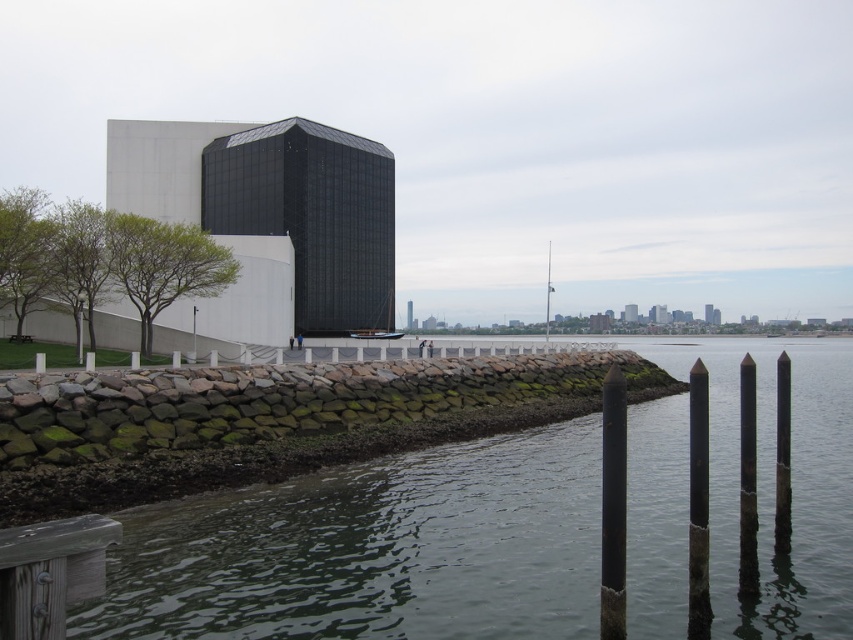
Who is taller, wooden dock at lower left or black matte pole at center?

Standing taller between the two is black matte pole at center.

Can you confirm if wooden dock at lower left is thinner than black matte pole at center?

Correct, wooden dock at lower left's width is less than black matte pole at center's.

Find the location of a particular element. wooden dock at lower left is located at coordinates coord(50,572).

Is black matte pole at lower right in front of black matte pole at center?

Yes.

What do you see at coordinates (613, 506) in the screenshot?
I see `black matte pole at lower right` at bounding box center [613, 506].

What do you see at coordinates (613, 506) in the screenshot? This screenshot has width=853, height=640. I see `black matte pole at lower right` at bounding box center [613, 506].

Where is `black matte pole at lower right`? black matte pole at lower right is located at coordinates (613, 506).

Is green stone wall at lower left positioned behind black matte pole at center?

No, it is not.

In the scene shown: Who is more distant from viewer, (244, 554) or (553, 288)?

The point (553, 288) is more distant.

Locate an element on the screen. green stone wall at lower left is located at coordinates (374, 550).

At what (x,y) coordinates should I click in order to perform the action: click on green stone wall at lower left. Please return your answer as a coordinate pair (x, y). The height and width of the screenshot is (640, 853). Looking at the image, I should click on (374, 550).